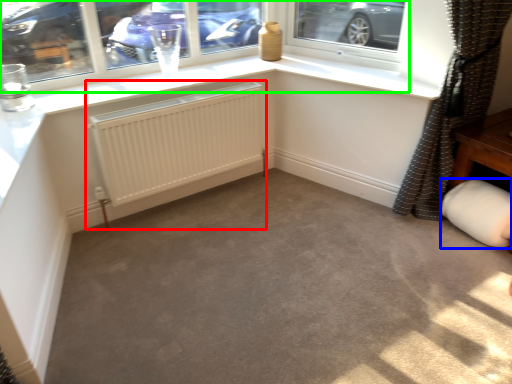
Question: Which is nearer to the radiator (highlighted by a red box)? gray (highlighted by a blue box) or window (highlighted by a green box).

Choices:
 (A) gray
 (B) window

Answer: (B)